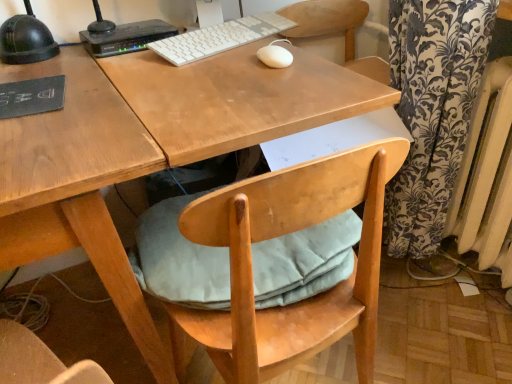
Question: Is black plastic router at upper left taller than light blue fabric cushion at under desk?

Choices:
 (A) yes
 (B) no

Answer: (A)

Question: Is black plastic router at upper left positioned before light blue fabric cushion at under desk?

Choices:
 (A) yes
 (B) no

Answer: (B)

Question: Is black plastic router at upper left shorter than light blue fabric cushion at under desk?

Choices:
 (A) yes
 (B) no

Answer: (B)

Question: Can you confirm if black plastic router at upper left is positioned to the right of light blue fabric cushion at under desk?

Choices:
 (A) yes
 (B) no

Answer: (B)

Question: Considering the relative sizes of black plastic router at upper left and light blue fabric cushion at under desk in the image provided, is black plastic router at upper left smaller than light blue fabric cushion at under desk?

Choices:
 (A) no
 (B) yes

Answer: (B)

Question: From the image's perspective, is black plastic router at upper left on light blue fabric cushion at under desk?

Choices:
 (A) no
 (B) yes

Answer: (B)

Question: Could you tell me if white matte mouse at center is facing black plastic router at upper left?

Choices:
 (A) no
 (B) yes

Answer: (A)

Question: From a real-world perspective, is white matte mouse at center located higher than black plastic router at upper left?

Choices:
 (A) no
 (B) yes

Answer: (A)

Question: Is white matte mouse at center in contact with black plastic router at upper left?

Choices:
 (A) yes
 (B) no

Answer: (B)

Question: Is black plastic router at upper left located within white matte mouse at center?

Choices:
 (A) no
 (B) yes

Answer: (A)

Question: Is white matte mouse at center bigger than black plastic router at upper left?

Choices:
 (A) no
 (B) yes

Answer: (A)

Question: From the image's perspective, is white matte mouse at center beneath black plastic router at upper left?

Choices:
 (A) no
 (B) yes

Answer: (B)

Question: Can you confirm if light blue fabric cushion at under desk is thinner than white painted metal radiator at right?

Choices:
 (A) no
 (B) yes

Answer: (A)